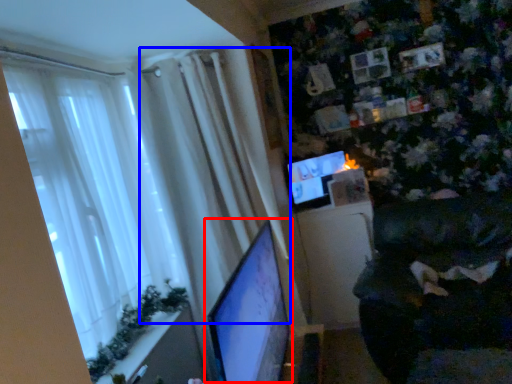
Question: Which of the following is the farthest to the observer, computer monitor (highlighted by a red box) or curtain (highlighted by a blue box)?

Choices:
 (A) computer monitor
 (B) curtain

Answer: (B)